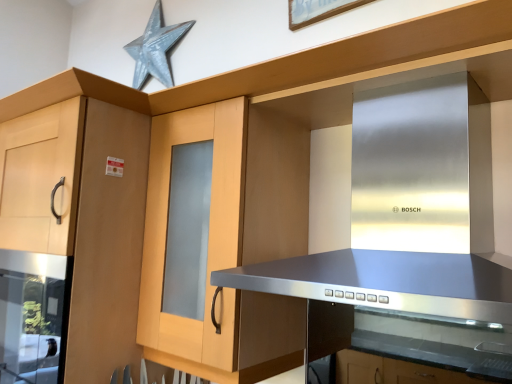
Question: Is metallic silver star at upper center positioned with its back to light wood cabinet at left?

Choices:
 (A) no
 (B) yes

Answer: (A)

Question: Is metallic silver star at upper center facing towards light wood cabinet at left?

Choices:
 (A) yes
 (B) no

Answer: (B)

Question: From a real-world perspective, is metallic silver star at upper center located beneath light wood cabinet at left?

Choices:
 (A) no
 (B) yes

Answer: (A)

Question: Is metallic silver star at upper center taller than light wood cabinet at left?

Choices:
 (A) yes
 (B) no

Answer: (B)

Question: From the image's perspective, would you say metallic silver star at upper center is shown under light wood cabinet at left?

Choices:
 (A) no
 (B) yes

Answer: (A)

Question: In terms of width, does stainless steel vent at center look wider or thinner when compared to metallic silver star at upper center?

Choices:
 (A) wide
 (B) thin

Answer: (A)

Question: Which is correct: stainless steel vent at center is inside metallic silver star at upper center, or outside of it?

Choices:
 (A) inside
 (B) outside

Answer: (B)

Question: Considering the relative positions of stainless steel vent at center and metallic silver star at upper center in the image provided, is stainless steel vent at center to the left or to the right of metallic silver star at upper center?

Choices:
 (A) right
 (B) left

Answer: (A)

Question: Is point (412, 223) closer or farther from the camera than point (144, 77)?

Choices:
 (A) farther
 (B) closer

Answer: (B)

Question: In the image, is light wood cabinet at left on the left side or the right side of stainless steel vent at center?

Choices:
 (A) left
 (B) right

Answer: (A)

Question: From the image's perspective, is light wood cabinet at left positioned above or below stainless steel vent at center?

Choices:
 (A) above
 (B) below

Answer: (B)

Question: In terms of width, does light wood cabinet at left look wider or thinner when compared to stainless steel vent at center?

Choices:
 (A) wide
 (B) thin

Answer: (A)

Question: From a real-world perspective, relative to stainless steel vent at center, is light wood cabinet at left vertically above or below?

Choices:
 (A) above
 (B) below

Answer: (B)

Question: Is point (68, 190) closer or farther from the camera than point (152, 64)?

Choices:
 (A) closer
 (B) farther

Answer: (A)

Question: From the image's perspective, is light wood cabinet at left above or below metallic silver star at upper center?

Choices:
 (A) above
 (B) below

Answer: (B)